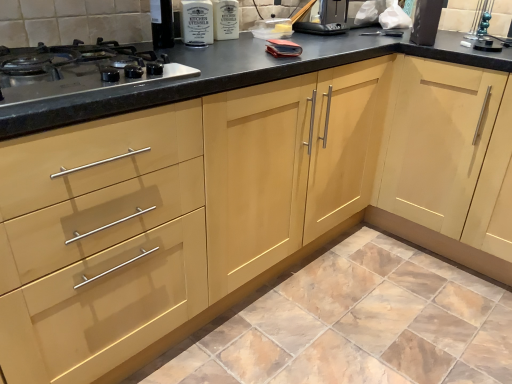
Question: In terms of height, does matte ceramic tile at lower center look taller or shorter compared to light wood cabinet at center?

Choices:
 (A) tall
 (B) short

Answer: (B)

Question: In the image, is matte ceramic tile at lower center positioned in front of or behind light wood cabinet at center?

Choices:
 (A) front
 (B) behind

Answer: (A)

Question: Estimate the real-world distances between objects in this image. Which object is farther from the black plastic toaster at upper center, positioned as the 1th appliance in back-to-front order?

Choices:
 (A) light wood cabinet at center
 (B) black matte toaster at upper right, acting as the 2th appliance starting from the left
 (C) matte ceramic tile at lower center
 (D) stainless steel gas stove at left

Answer: (C)

Question: Which object is positioned farthest from the light wood cabinet at center?

Choices:
 (A) matte ceramic tile at lower center
 (B) stainless steel gas stove at left
 (C) black matte toaster at upper right, acting as the first appliance starting from the right
 (D) black plastic toaster at upper center, which appears as the 2th appliance when viewed from the right

Answer: (B)